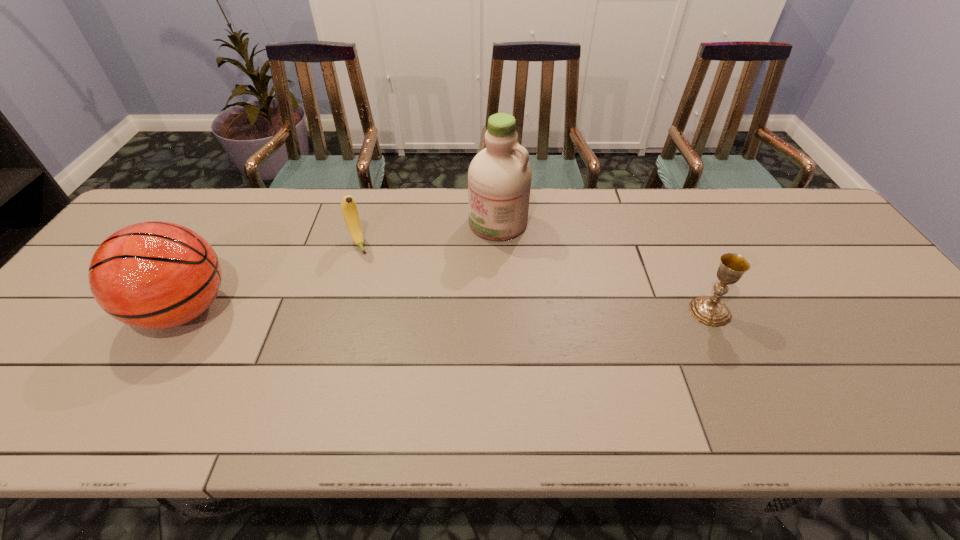
Identify the location of vacant space on the desktop that is between the basketball and the rightmost object and is positioned on the front label of the tallest object. (379, 310).

Locate an element on the screen. Image resolution: width=960 pixels, height=540 pixels. vacant space on the desktop that is between the third shortest object and the rightmost object and is positioned from the stem of the second object from left to right is located at coordinates (391, 310).